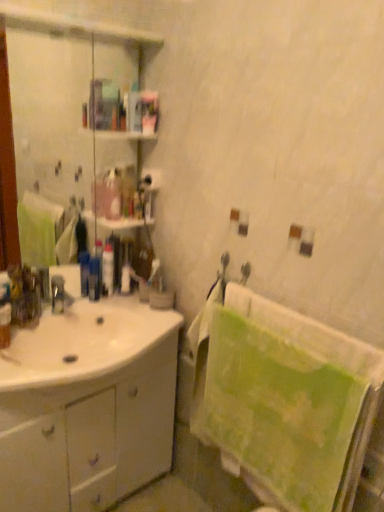
Question: Is green textured towel at right situated inside white glossy cabinet at left or outside?

Choices:
 (A) inside
 (B) outside

Answer: (B)

Question: From the image's perspective, is green textured towel at right above or below white glossy cabinet at left?

Choices:
 (A) below
 (B) above

Answer: (B)

Question: Which object is the closest to the blue plastic toothbrush at center, which ranks as the 3th toiletry in right-to-left order?

Choices:
 (A) white matte toilet paper at upper center
 (B) matte silver faucet at center
 (C) white glossy bottle at center, which is the second toiletry from left to right
 (D) white glossy sink at lower left
 (E) green textured towel at right

Answer: (C)

Question: Based on their relative distances, which object is nearer to the clear glass mirror at upper left?

Choices:
 (A) white glossy sink at lower left
 (B) green textured towel at right
 (C) white glossy cabinet at left
 (D) white glossy bottle at center, marked as the second toiletry in a right-to-left arrangement
 (E) blue plastic toothbrush at center, which ranks as the 3th toiletry in right-to-left order

Answer: (A)